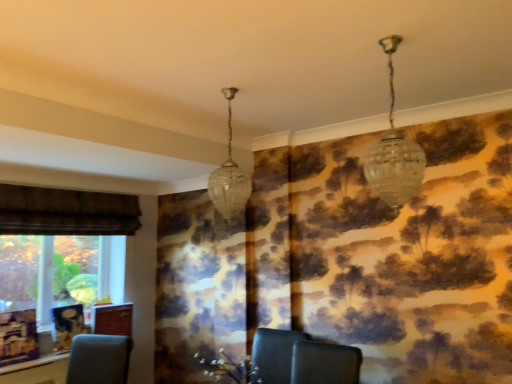
Question: In terms of width, does clear glass pendant light at center, which is counted as the 1th lamp, starting from the back, look wider or thinner when compared to clear glass chandelier at upper right, the second lamp from the left?

Choices:
 (A) thin
 (B) wide

Answer: (A)

Question: From their relative heights in the image, would you say clear glass pendant light at center, positioned as the second lamp in front-to-back order, is taller or shorter than clear glass chandelier at upper right, acting as the 1th lamp starting from the front?

Choices:
 (A) short
 (B) tall

Answer: (B)

Question: Relative to clear glass chandelier at upper right, which is counted as the 2th lamp, starting from the back, is clear glass pendant light at center, which is the 1th lamp in left-to-right order, in front or behind?

Choices:
 (A) front
 (B) behind

Answer: (B)

Question: Is clear glass chandelier at upper right, which is counted as the 2th lamp, starting from the back, situated inside clear glass pendant light at center, which is counted as the 1th lamp, starting from the back, or outside?

Choices:
 (A) outside
 (B) inside

Answer: (A)

Question: From a real-world perspective, is clear glass chandelier at upper right, which is the 1th lamp in right-to-left order, physically located above or below clear glass pendant light at center, which is counted as the 1th lamp, starting from the back?

Choices:
 (A) above
 (B) below

Answer: (A)

Question: Considering the relative positions of clear glass chandelier at upper right, which is counted as the 2th lamp, starting from the back, and clear glass pendant light at center, positioned as the second lamp in front-to-back order, in the image provided, is clear glass chandelier at upper right, which is counted as the 2th lamp, starting from the back, to the left or to the right of clear glass pendant light at center, positioned as the second lamp in front-to-back order,?

Choices:
 (A) right
 (B) left

Answer: (A)

Question: In terms of width, does clear glass chandelier at upper right, which is the 1th lamp in right-to-left order, look wider or thinner when compared to clear glass pendant light at center, which is the 1th lamp in left-to-right order?

Choices:
 (A) thin
 (B) wide

Answer: (B)